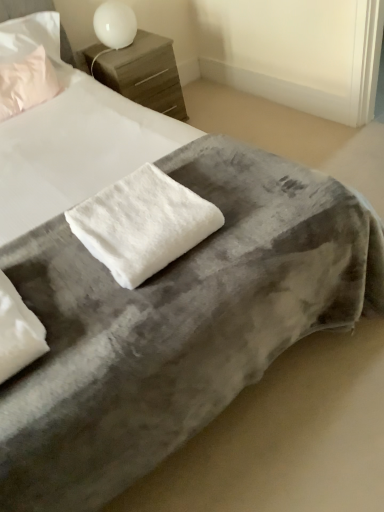
The width and height of the screenshot is (384, 512). I want to click on vacant area on the back side of white fluffy pillow at lower left, the 1th pillow when ordered from front to back, so (x=37, y=260).